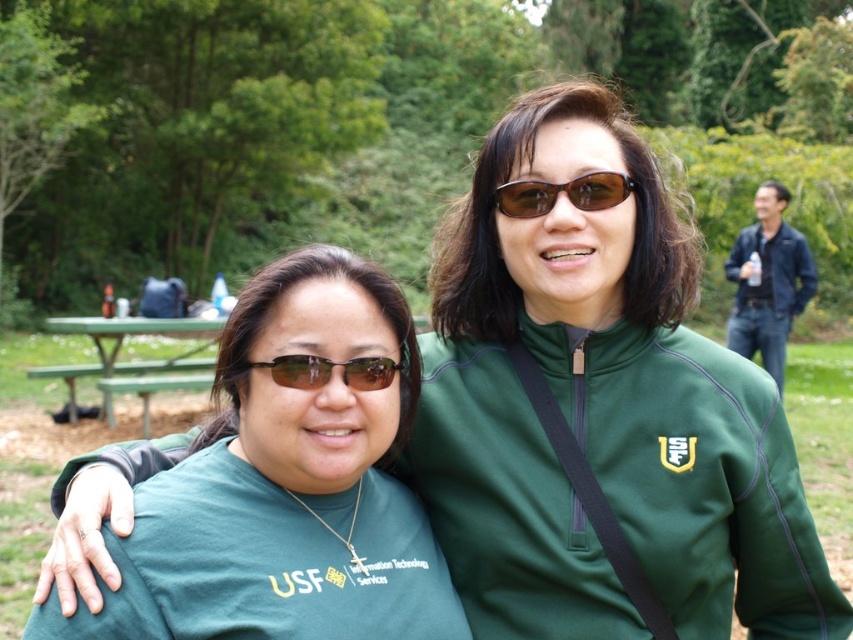
Can you confirm if green matte shirt at center is positioned above black leather jacket at upper right?

No.

The height and width of the screenshot is (640, 853). Identify the location of green matte shirt at center. (286, 486).

Is black leather jacket at upper right further to camera compared to green painted wood picnic table at lower left?

Yes, black leather jacket at upper right is further from the viewer.

Does black leather jacket at upper right have a lesser width compared to green painted wood picnic table at lower left?

Yes.

Find the location of a particular element. This screenshot has width=853, height=640. black leather jacket at upper right is located at coordinates (x=769, y=282).

Is point (752, 240) less distant than point (346, 372)?

That is False.

Is black leather jacket at upper right to the left of matte black sunglasses at center from the viewer's perspective?

Incorrect, black leather jacket at upper right is not on the left side of matte black sunglasses at center.

Locate an element on the screen. black leather jacket at upper right is located at coordinates (769, 282).